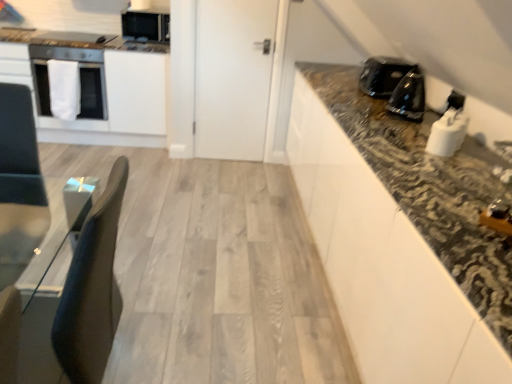
Question: Based on their positions, is white matte oven at left located to the left or right of black granite countertop at upper right?

Choices:
 (A) right
 (B) left

Answer: (B)

Question: In terms of height, does white matte oven at left look taller or shorter compared to black granite countertop at upper right?

Choices:
 (A) short
 (B) tall

Answer: (A)

Question: Based on their relative distances, which object is farther from the metallic silver toaster at upper left, the first appliance from the left?

Choices:
 (A) black granite countertop at upper right
 (B) white glossy toaster at upper right, the fourth appliance from the back
 (C) black glossy coffee maker at upper right
 (D) black glossy kettle at right, which ranks as the third appliance in back-to-front order
 (E) matte black microwave at upper left, acting as the 3th appliance starting from the right

Answer: (B)

Question: Considering the real-world distances, which object is closest to the black glossy coffee maker at upper right?

Choices:
 (A) white glossy toaster at upper right, acting as the 1th appliance starting from the right
 (B) metallic silver toaster at upper left, which appears as the third appliance when viewed from the front
 (C) white glossy oven at left
 (D) matte black microwave at upper left, the first appliance from the top
 (E) black granite countertop at upper right

Answer: (E)